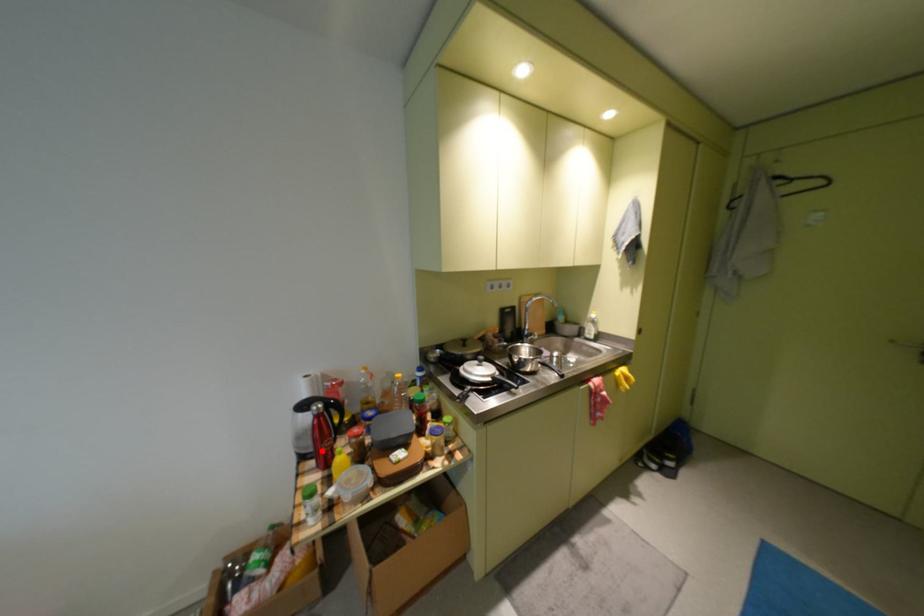
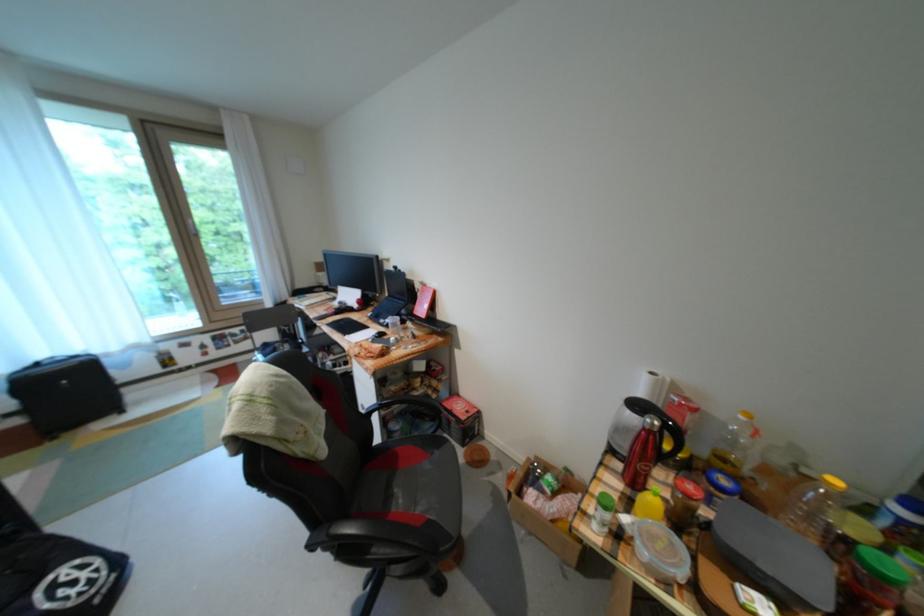
The point at the highlighted location is marked in the first image. Where is the corresponding point in the second image?

(636, 455)